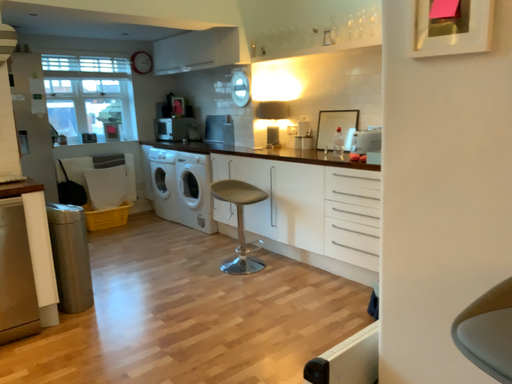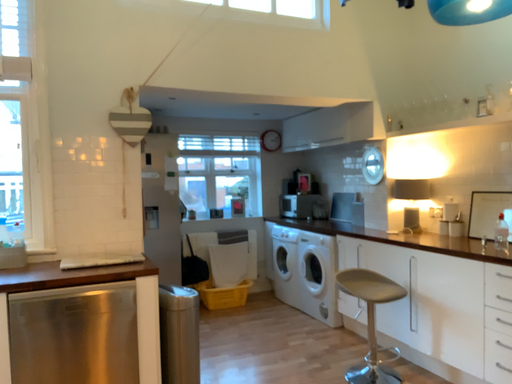
Question: Which way did the camera rotate in the video?

Choices:
 (A) rotated right
 (B) rotated left

Answer: (B)